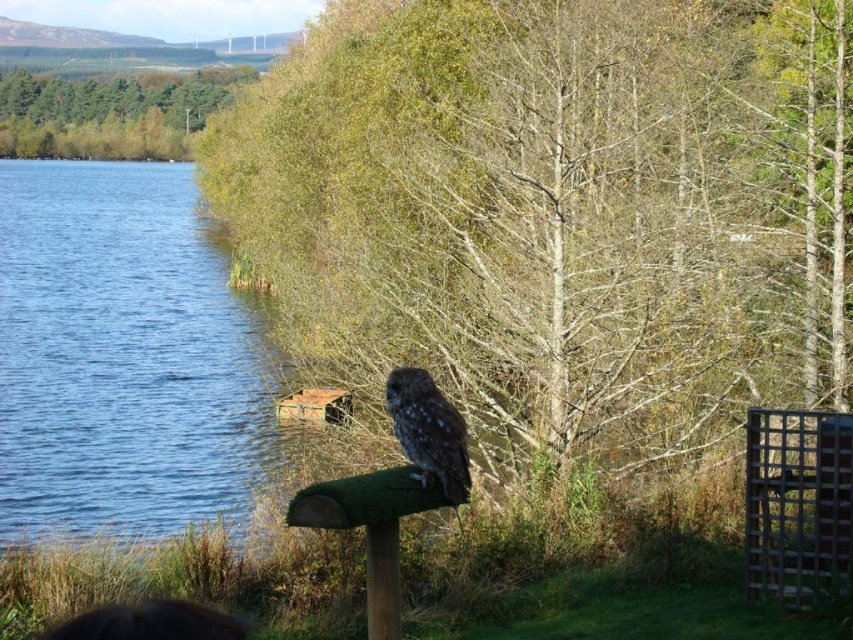
Question: Which of these objects is positioned farthest from the speckled brown owl at center?

Choices:
 (A) green leafy trees at upper left
 (B) blue water at left

Answer: (A)

Question: Is blue water at left positioned behind speckled brown owl at center?

Choices:
 (A) no
 (B) yes

Answer: (B)

Question: Which of the following is the closest to the observer?

Choices:
 (A) blue water at left
 (B) brown textured tree at center

Answer: (B)

Question: Which is farther from the blue water at left?

Choices:
 (A) green leafy trees at upper left
 (B) brown textured tree at center

Answer: (A)

Question: In this image, where is brown textured tree at center located relative to speckled brown owl at center?

Choices:
 (A) right
 (B) left

Answer: (B)

Question: Does blue water at left have a greater width compared to speckled brown owl at center?

Choices:
 (A) yes
 (B) no

Answer: (A)